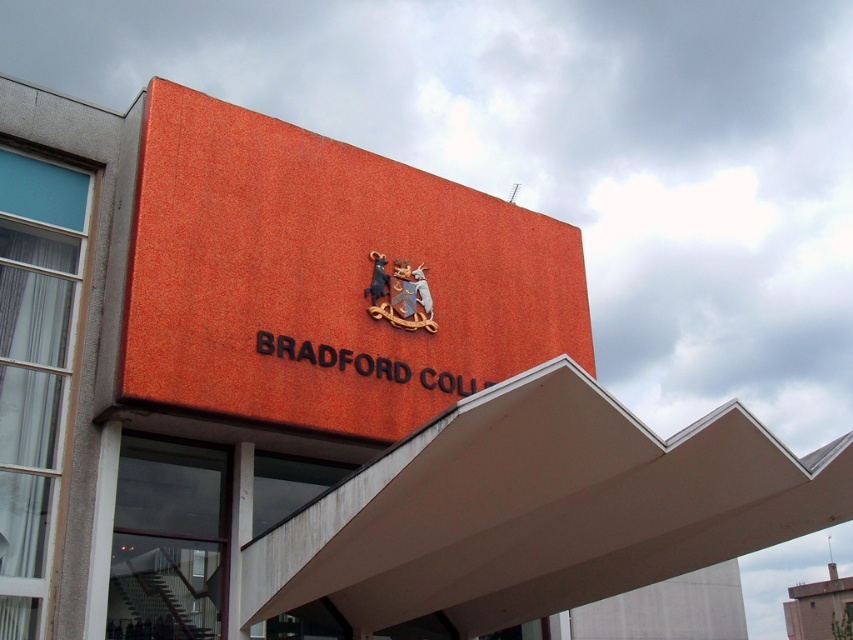
You are a visitor approaching the Bradford College building and need to locate the entrance. You see the orange textured sign at center and the wooden coat of arms at center. Which object is bigger and can help you find the entrance?

The orange textured sign at center is larger in size than the wooden coat of arms at center, so the orange textured sign at center is bigger and can help you find the entrance.

You are a visitor arriving at Bradford College and need to locate the entrance. The orange textured sign at center and the wooden coat of arms at center are both on the main building. Which object is closer to the ground?

The wooden coat of arms at center is closer to the ground because the orange textured sign at center is located above it.

You are standing in front of the Bradford College building and need to locate the entrance. The entrance is to the right of the orange textured sign at center. Is the entrance also to the right of the wooden coat of arms at center?

The orange textured sign at center is to the left of the wooden coat of arms at center. Since the entrance is to the right of the orange textured sign at center, it would also be to the right of the wooden coat of arms at center.